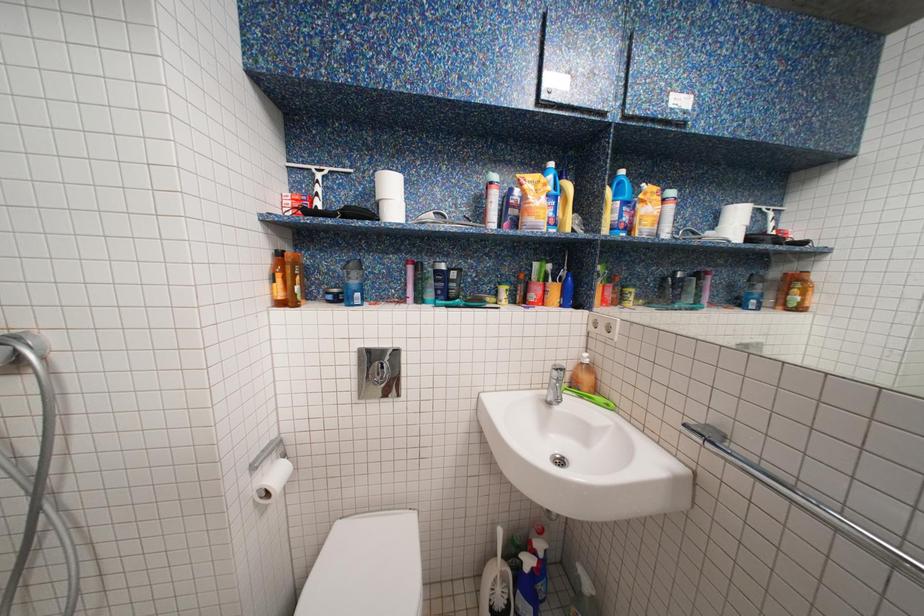
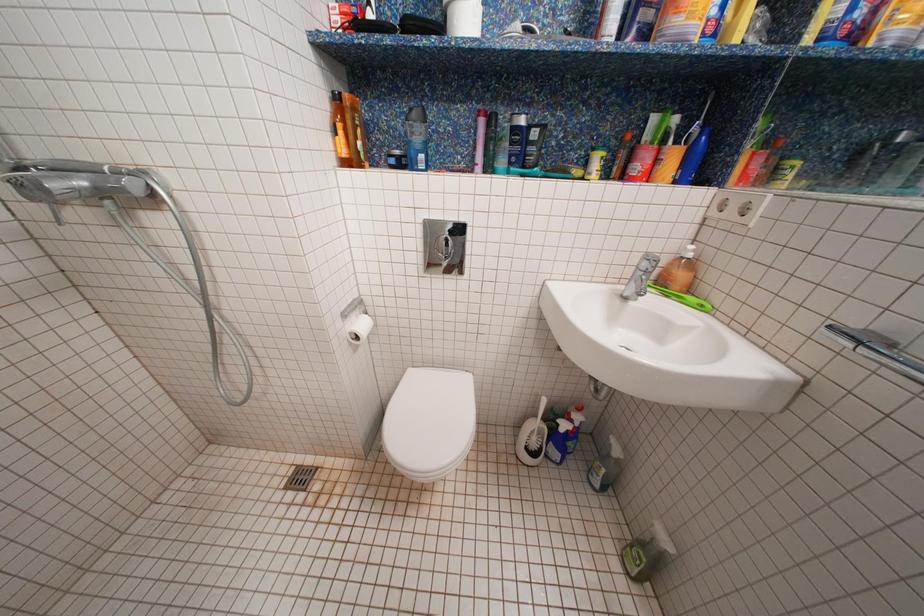
In the scene shown: What movement of the cameraman would produce the second image?

The cameraman walked toward left, forward.